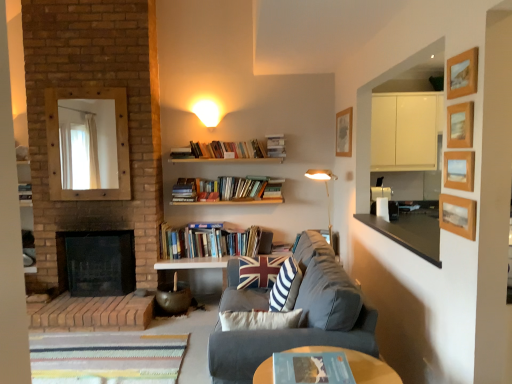
Question: Is hardcover book at upper center, acting as the 1th book starting from the back, far from brick fireplace at left?

Choices:
 (A) yes
 (B) no

Answer: (A)

Question: From the image's perspective, is hardcover book at upper center, the first book in the top-to-bottom sequence, beneath brick fireplace at left?

Choices:
 (A) yes
 (B) no

Answer: (B)

Question: Is hardcover book at upper center, the third book from the bottom, at the right side of brick fireplace at left?

Choices:
 (A) yes
 (B) no

Answer: (A)

Question: Is the position of hardcover book at upper center, the 3th book in the front-to-back sequence, less distant than that of brick fireplace at left?

Choices:
 (A) yes
 (B) no

Answer: (B)

Question: Does hardcover book at upper center, the first book in the top-to-bottom sequence, have a lesser width compared to brick fireplace at left?

Choices:
 (A) no
 (B) yes

Answer: (B)

Question: From the image's perspective, is hardcover books at center, marked as the 2th book in a top-to-bottom arrangement, located above or below union jack fabric pillow at center?

Choices:
 (A) below
 (B) above

Answer: (B)

Question: Based on their positions, is hardcover books at center, which is the second book from front to back, located to the left or right of union jack fabric pillow at center?

Choices:
 (A) left
 (B) right

Answer: (A)

Question: Relative to union jack fabric pillow at center, is hardcover books at center, which is the second book from front to back, in front or behind?

Choices:
 (A) behind
 (B) front

Answer: (A)

Question: Is hardcover books at center, the 2th book when ordered from back to front, inside the boundaries of union jack fabric pillow at center, or outside?

Choices:
 (A) outside
 (B) inside

Answer: (A)

Question: Considering the relative positions of wooden mirror at upper left and blue paper book at center, marked as the 3th book in a back-to-front arrangement, in the image provided, is wooden mirror at upper left to the left or to the right of blue paper book at center, marked as the 3th book in a back-to-front arrangement,?

Choices:
 (A) left
 (B) right

Answer: (A)

Question: Considering their positions, is wooden mirror at upper left located in front of or behind blue paper book at center, marked as the 3th book in a back-to-front arrangement?

Choices:
 (A) behind
 (B) front

Answer: (A)

Question: From a real-world perspective, is wooden mirror at upper left positioned above or below blue paper book at center, placed as the third book when sorted from top to bottom?

Choices:
 (A) above
 (B) below

Answer: (A)

Question: Considering the positions of wooden mirror at upper left and blue paper book at center, marked as the 3th book in a back-to-front arrangement, in the image, is wooden mirror at upper left wider or thinner than blue paper book at center, marked as the 3th book in a back-to-front arrangement,?

Choices:
 (A) thin
 (B) wide

Answer: (A)

Question: Looking at the image, does dark gray fabric couch at center seem bigger or smaller compared to wooden picture frame at upper right, which ranks as the 3th picture frame in top-to-bottom order?

Choices:
 (A) big
 (B) small

Answer: (A)

Question: Is point (340, 344) positioned closer to the camera than point (458, 117)?

Choices:
 (A) closer
 (B) farther

Answer: (B)